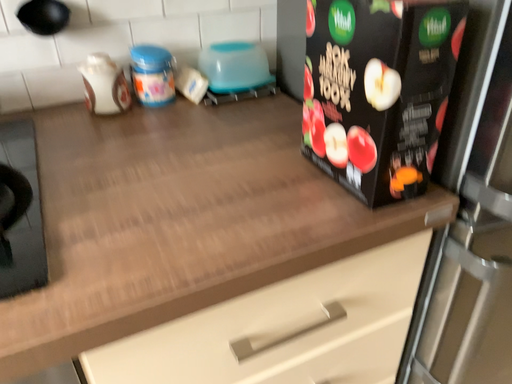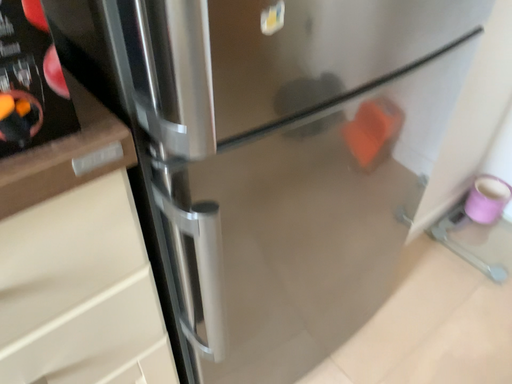
Question: How did the camera likely rotate when shooting the video?

Choices:
 (A) rotated left
 (B) rotated right

Answer: (B)